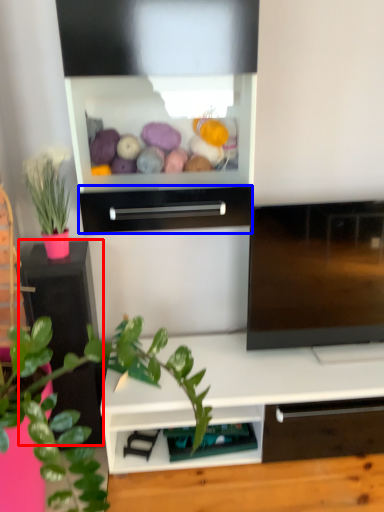
Question: Which object appears closest to the camera in this image, table (highlighted by a red box) or drawer (highlighted by a blue box)?

Choices:
 (A) table
 (B) drawer

Answer: (B)